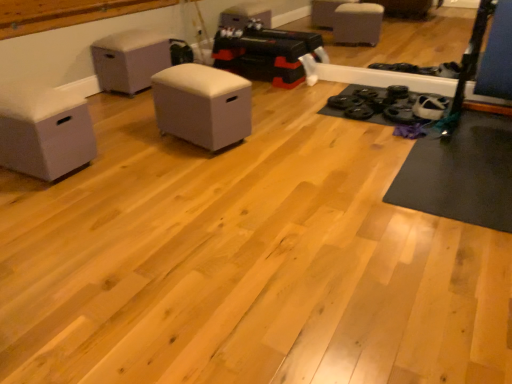
Locate an element on the screen. The image size is (512, 384). white fabric ottoman at center, placed as the third furniture when sorted from left to right is located at coordinates (202, 105).

What is the approximate height of white fabric ottoman at center, the second furniture positioned from the right?

21.55 inches.

Image resolution: width=512 pixels, height=384 pixels. What do you see at coordinates (129, 60) in the screenshot?
I see `white fabric ottoman at center, positioned as the second furniture in left-to-right order` at bounding box center [129, 60].

Image resolution: width=512 pixels, height=384 pixels. Find the location of `white fabric ottoman at center, which is counted as the first furniture, starting from the right`. white fabric ottoman at center, which is counted as the first furniture, starting from the right is located at coordinates (202, 105).

Is the depth of white fabric ottoman at left, which ranks as the 1th furniture in front-to-back order, less than that of white fabric ottoman at center, acting as the 1th furniture starting from the back?

Yes, it is.

From the image's perspective, would you say white fabric ottoman at left, which is the first furniture from left to right, is shown under white fabric ottoman at center, the second furniture positioned from the right?

Yes.

In the scene shown: Who is shorter, white fabric ottoman at left, which ranks as the 1th furniture in front-to-back order, or white fabric ottoman at center, the second furniture positioned from the right?

white fabric ottoman at left, which ranks as the 1th furniture in front-to-back order, is shorter.

Is white fabric ottoman at left, which ranks as the 1th furniture in front-to-back order, wider or thinner than white fabric ottoman at center, which is counted as the first furniture, starting from the right?

In the image, white fabric ottoman at left, which ranks as the 1th furniture in front-to-back order, appears to be wider than white fabric ottoman at center, which is counted as the first furniture, starting from the right.

Between point (23, 124) and point (191, 82), which one is positioned behind?

The point (191, 82) is farther.

Looking at this image, is white fabric ottoman at left, which is the third furniture in back-to-front order, bigger than white fabric ottoman at center, which is counted as the second furniture, starting from the back?

No.

In the scene shown: Are white fabric ottoman at center, which is counted as the second furniture, starting from the back, and white fabric ottoman at left, which ranks as the 1th furniture in front-to-back order, located far from each other?

No, white fabric ottoman at center, which is counted as the second furniture, starting from the back, is in close proximity to white fabric ottoman at left, which ranks as the 1th furniture in front-to-back order.

Which object is further away from the camera, white fabric ottoman at center, which is counted as the second furniture, starting from the back, or white fabric ottoman at left, which is the first furniture from left to right?

white fabric ottoman at center, which is counted as the second furniture, starting from the back, is further from the camera.

Considering the sizes of objects white fabric ottoman at center, which is counted as the second furniture, starting from the back, and white fabric ottoman at left, which is the third furniture in back-to-front order, in the image provided, who is taller, white fabric ottoman at center, which is counted as the second furniture, starting from the back, or white fabric ottoman at left, which is the third furniture in back-to-front order,?

With more height is white fabric ottoman at center, which is counted as the second furniture, starting from the back.

How different are the orientations of white fabric ottoman at center, which is counted as the second furniture, starting from the back, and white fabric ottoman at left, which ranks as the 1th furniture in front-to-back order, in degrees?

The angle between the facing direction of white fabric ottoman at center, which is counted as the second furniture, starting from the back, and the facing direction of white fabric ottoman at left, which ranks as the 1th furniture in front-to-back order, is 105 degrees.

Is white fabric ottoman at center, acting as the 1th furniture starting from the back, directly adjacent to white fabric ottoman at center, which is counted as the first furniture, starting from the right?

No, white fabric ottoman at center, acting as the 1th furniture starting from the back, is not touching white fabric ottoman at center, which is counted as the first furniture, starting from the right.

How different are the orientations of white fabric ottoman at center, positioned as the 3th furniture in front-to-back order, and white fabric ottoman at center, marked as the 2th furniture in a front-to-back arrangement, in degrees?

They differ by 104 degrees in their facing directions.

From a real-world perspective, is white fabric ottoman at center, positioned as the 3th furniture in front-to-back order, physically below white fabric ottoman at center, marked as the 2th furniture in a front-to-back arrangement?

Incorrect, from a real-world perspective, white fabric ottoman at center, positioned as the 3th furniture in front-to-back order, is higher than white fabric ottoman at center, marked as the 2th furniture in a front-to-back arrangement.

Considering the relative sizes of white fabric ottoman at center, positioned as the 3th furniture in front-to-back order, and white fabric ottoman at center, which is counted as the second furniture, starting from the back, in the image provided, is white fabric ottoman at center, positioned as the 3th furniture in front-to-back order, bigger than white fabric ottoman at center, which is counted as the second furniture, starting from the back,?

Correct, white fabric ottoman at center, positioned as the 3th furniture in front-to-back order, is larger in size than white fabric ottoman at center, which is counted as the second furniture, starting from the back.

Is white fabric ottoman at center, positioned as the 3th furniture in front-to-back order, oriented towards white fabric ottoman at left, which ranks as the 1th furniture in front-to-back order?

No, white fabric ottoman at center, positioned as the 3th furniture in front-to-back order, is not facing towards white fabric ottoman at left, which ranks as the 1th furniture in front-to-back order.

Is white fabric ottoman at center, positioned as the second furniture in left-to-right order, shorter than white fabric ottoman at left, which is the third furniture in back-to-front order?

No.

From the image's perspective, is white fabric ottoman at center, positioned as the second furniture in left-to-right order, positioned above or below white fabric ottoman at left, which is the third furniture in back-to-front order?

white fabric ottoman at center, positioned as the second furniture in left-to-right order, is above white fabric ottoman at left, which is the third furniture in back-to-front order.

Which object is more forward, white fabric ottoman at center, positioned as the 3th furniture in front-to-back order, or white fabric ottoman at left, the third furniture viewed from the right?

white fabric ottoman at left, the third furniture viewed from the right, is more forward.

Is white fabric ottoman at center, marked as the 2th furniture in a front-to-back arrangement, behind white fabric ottoman at center, positioned as the second furniture in left-to-right order?

No, white fabric ottoman at center, marked as the 2th furniture in a front-to-back arrangement, is closer to the viewer.

Which object is positioned more to the right, white fabric ottoman at center, marked as the 2th furniture in a front-to-back arrangement, or white fabric ottoman at center, the second furniture positioned from the right?

Positioned to the right is white fabric ottoman at center, marked as the 2th furniture in a front-to-back arrangement.

Is point (213, 94) positioned in front of point (139, 54)?

Yes, point (213, 94) is in front of point (139, 54).

Which furniture is the 1st one when counting from the left side of the white fabric ottoman at center, which is counted as the second furniture, starting from the back? Please provide its 2D coordinates.

[(129, 60)]

Where is `furniture on the left of the white fabric ottoman at center, positioned as the 3th furniture in front-to-back order`? furniture on the left of the white fabric ottoman at center, positioned as the 3th furniture in front-to-back order is located at coordinates coord(44,131).

Find the location of a particular element. The height and width of the screenshot is (384, 512). furniture in front of the white fabric ottoman at center, marked as the 2th furniture in a front-to-back arrangement is located at coordinates (44, 131).

Looking at the image, which one is located closer to white fabric ottoman at left, which is the third furniture in back-to-front order, white fabric ottoman at center, marked as the 2th furniture in a front-to-back arrangement, or white fabric ottoman at center, positioned as the 3th furniture in front-to-back order?

white fabric ottoman at center, marked as the 2th furniture in a front-to-back arrangement.

Considering their positions, is white fabric ottoman at left, which is the first furniture from left to right, positioned closer to white fabric ottoman at center, placed as the third furniture when sorted from left to right, than white fabric ottoman at center, the second furniture positioned from the right?

The object closer to white fabric ottoman at center, placed as the third furniture when sorted from left to right, is white fabric ottoman at left, which is the first furniture from left to right.

Based on their spatial positions, is white fabric ottoman at center, positioned as the 3th furniture in front-to-back order, or white fabric ottoman at center, placed as the third furniture when sorted from left to right, closer to white fabric ottoman at left, which is the first furniture from left to right?

white fabric ottoman at center, placed as the third furniture when sorted from left to right, lies closer to white fabric ottoman at left, which is the first furniture from left to right, than the other object.

Based on their spatial positions, is white fabric ottoman at left, which is the first furniture from left to right, or white fabric ottoman at center, which is counted as the first furniture, starting from the right, further from white fabric ottoman at center, acting as the 1th furniture starting from the back?

Among the two, white fabric ottoman at left, which is the first furniture from left to right, is located further to white fabric ottoman at center, acting as the 1th furniture starting from the back.

Based on the photo, from the image, which object appears to be nearer to white fabric ottoman at center, placed as the third furniture when sorted from left to right, white fabric ottoman at center, the second furniture positioned from the right, or white fabric ottoman at left, which is the first furniture from left to right?

white fabric ottoman at left, which is the first furniture from left to right, lies closer to white fabric ottoman at center, placed as the third furniture when sorted from left to right, than the other object.

From the image, which object appears to be farther from white fabric ottoman at center, the second furniture positioned from the right, white fabric ottoman at center, marked as the 2th furniture in a front-to-back arrangement, or white fabric ottoman at left, the third furniture viewed from the right?

white fabric ottoman at left, the third furniture viewed from the right.

Identify the location of furniture between white fabric ottoman at left, the third furniture viewed from the right, and white fabric ottoman at center, acting as the 1th furniture starting from the back, in the front-back direction. (202, 105).